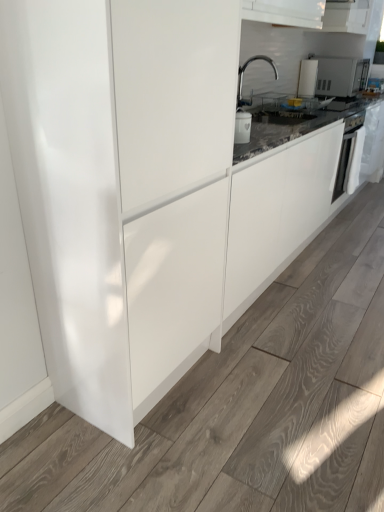
The width and height of the screenshot is (384, 512). Identify the location of empty space that is to the right of glossy white cabinet at center. (259, 382).